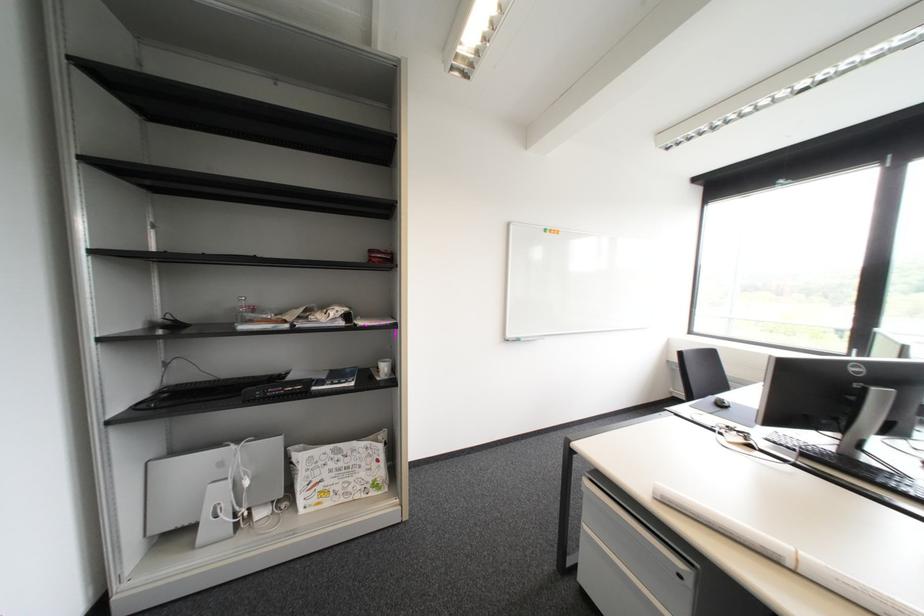
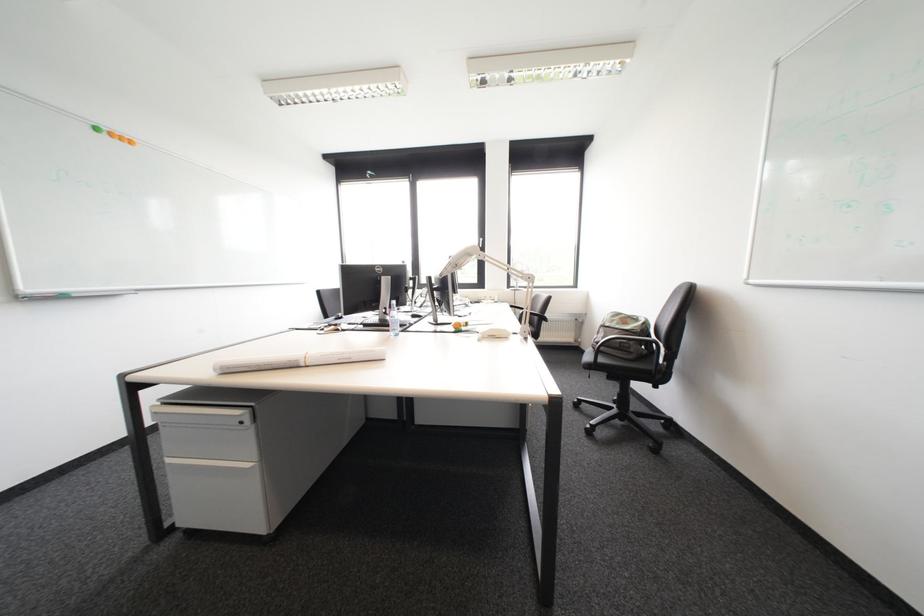
Question: How did the camera likely rotate?

Choices:
 (A) Left
 (B) Right
 (C) Up
 (D) Down

Answer: (B)